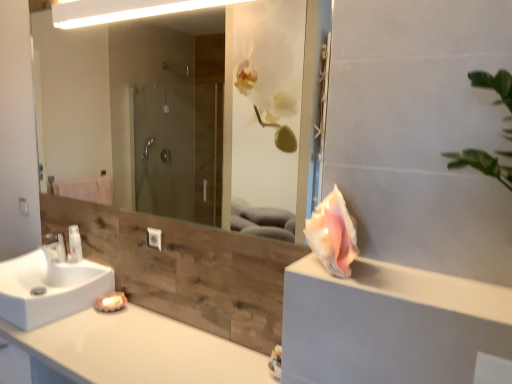
Question: In the image, is pink shell at right positioned in front of or behind pink shell at right?

Choices:
 (A) front
 (B) behind

Answer: (B)

Question: From a real-world perspective, is pink shell at right positioned above or below pink shell at right?

Choices:
 (A) below
 (B) above

Answer: (B)

Question: Considering the real-world distances, which object is closest to the pink shell at right?

Choices:
 (A) white glossy light fixture at upper center
 (B) white glossy faucet at lower left
 (C) white glossy sink at lower left
 (D) pink shell at right
 (E) white glossy countertop at lower left

Answer: (D)

Question: Which object is the farthest from the white glossy countertop at lower left?

Choices:
 (A) pink shell at right
 (B) white glossy bottle at left
 (C) pink shell at right
 (D) transparent glass mirror at upper center
 (E) white glossy sink at lower left

Answer: (D)